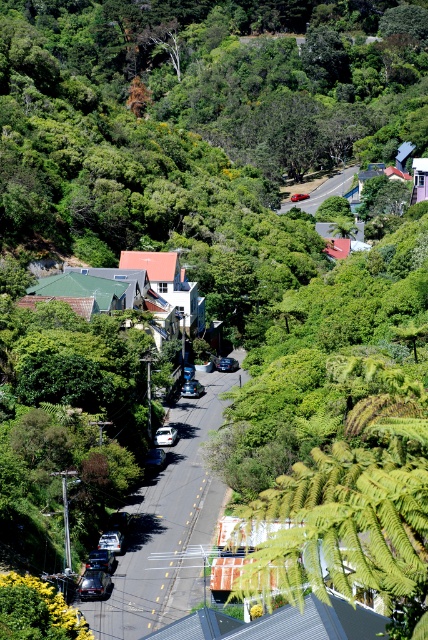
Measure the distance between metallic blue sedan at center and camera.

metallic blue sedan at center and camera are 137.08 meters apart.

Between point (187, 381) and point (231, 364), which one is positioned in front?

Positioned in front is point (187, 381).

Image resolution: width=428 pixels, height=640 pixels. I want to click on metallic blue sedan at center, so click(192, 388).

Can you confirm if white matte car at center is thinner than shiny silver sedan at center?

Indeed, white matte car at center has a lesser width compared to shiny silver sedan at center.

Between white matte car at center and shiny silver sedan at center, which one has more height?

Standing taller between the two is shiny silver sedan at center.

Is point (169, 429) farther from camera compared to point (228, 365)?

That is False.

In order to click on white matte car at center in this screenshot , I will do `click(165, 435)`.

Does white matte car at center appear under metallic blue sedan at center?

Yes.

Is white matte car at center smaller than metallic blue sedan at center?

Yes, white matte car at center is smaller than metallic blue sedan at center.

Which is in front, point (165, 442) or point (192, 380)?

Point (165, 442)

Locate an element on the screen. The width and height of the screenshot is (428, 640). white matte car at center is located at coordinates (165, 435).